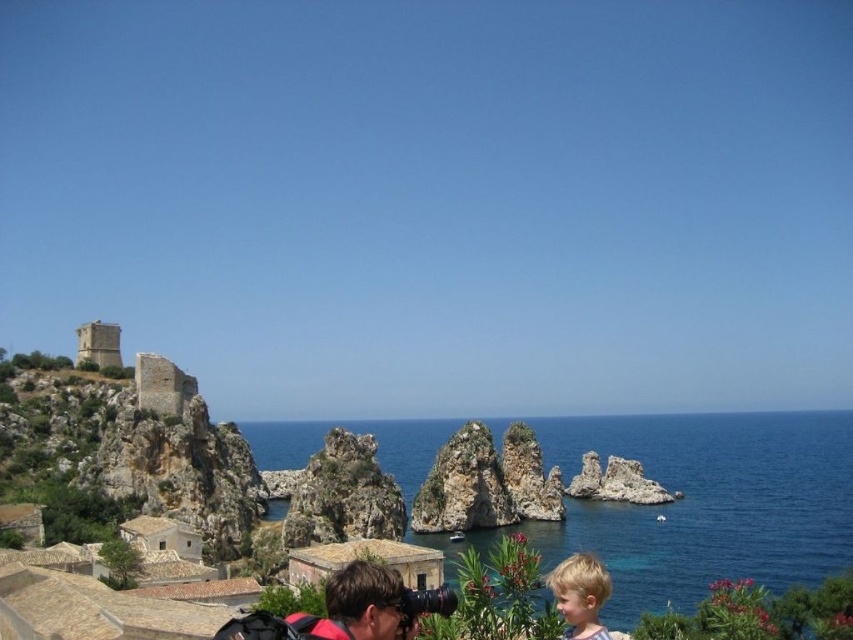
Is point (772, 458) closer to camera compared to point (595, 561)?

That is False.

Who is more forward, (268,429) or (566,588)?

Point (566,588) is in front.

This screenshot has height=640, width=853. I want to click on blue water at center, so click(x=698, y=504).

Who is shorter, rugged stone rock formation at center or blonde hair at lower right?

Standing shorter between the two is rugged stone rock formation at center.

Consider the image. Measure the distance between rugged stone rock formation at center and blonde hair at lower right.

A distance of 106.10 feet exists between rugged stone rock formation at center and blonde hair at lower right.

Is point (306, 502) positioned after point (579, 577)?

Yes, point (306, 502) is farther from viewer.

Locate an element on the screen. This screenshot has height=640, width=853. rugged stone rock formation at center is located at coordinates (343, 493).

Who is lower down, blue water at center or matte black camera at lower center?

blue water at center is below.

Between point (693, 516) and point (354, 611), which one is positioned in front?

Point (354, 611) is more forward.

The width and height of the screenshot is (853, 640). What are the coordinates of `blue water at center` in the screenshot? It's located at (698, 504).